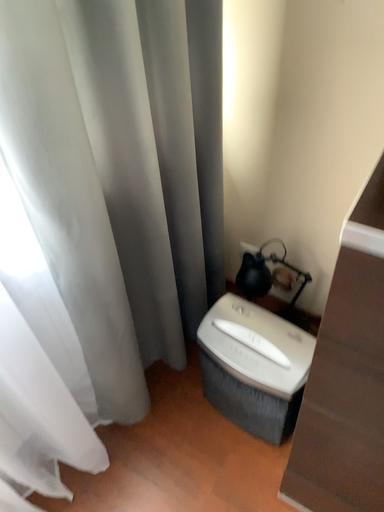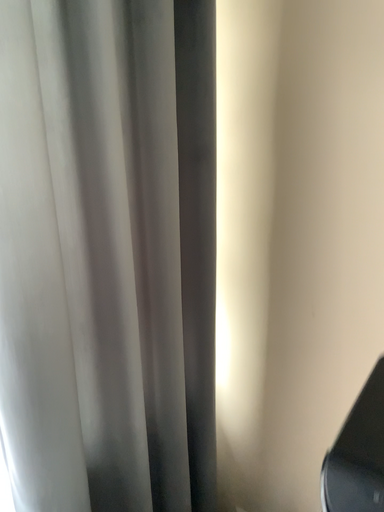
Question: Which way did the camera rotate in the video?

Choices:
 (A) rotated upward
 (B) rotated downward

Answer: (A)